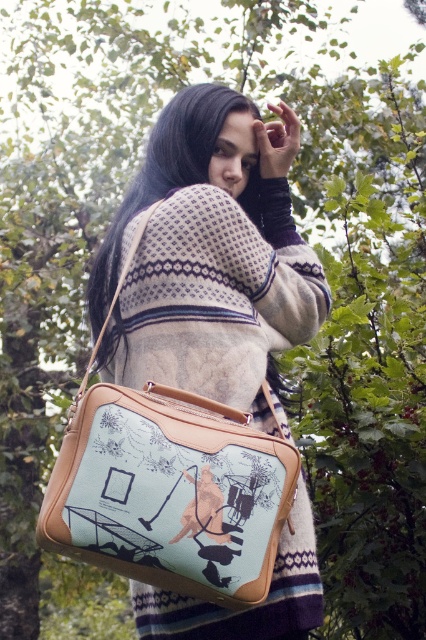
Question: Does matte beige bag at lower left have a smaller size compared to light blue fabric bag at center?

Choices:
 (A) yes
 (B) no

Answer: (B)

Question: Among these points, which one is farthest from the camera?

Choices:
 (A) (160, 360)
 (B) (161, 403)

Answer: (A)

Question: Is matte beige bag at lower left wider than light blue fabric bag at center?

Choices:
 (A) yes
 (B) no

Answer: (A)

Question: Does matte beige bag at lower left appear over light blue fabric bag at center?

Choices:
 (A) yes
 (B) no

Answer: (A)